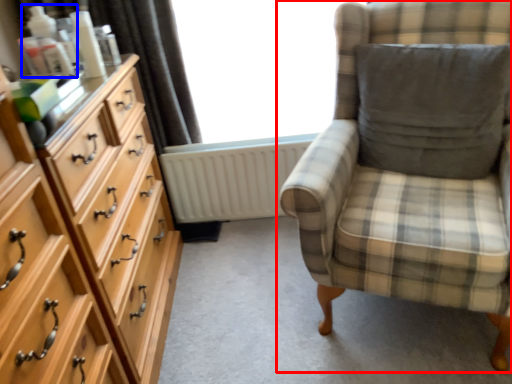
Question: Which point is further to the camera, chair (highlighted by a red box) or toiletry (highlighted by a blue box)?

Choices:
 (A) chair
 (B) toiletry

Answer: (B)